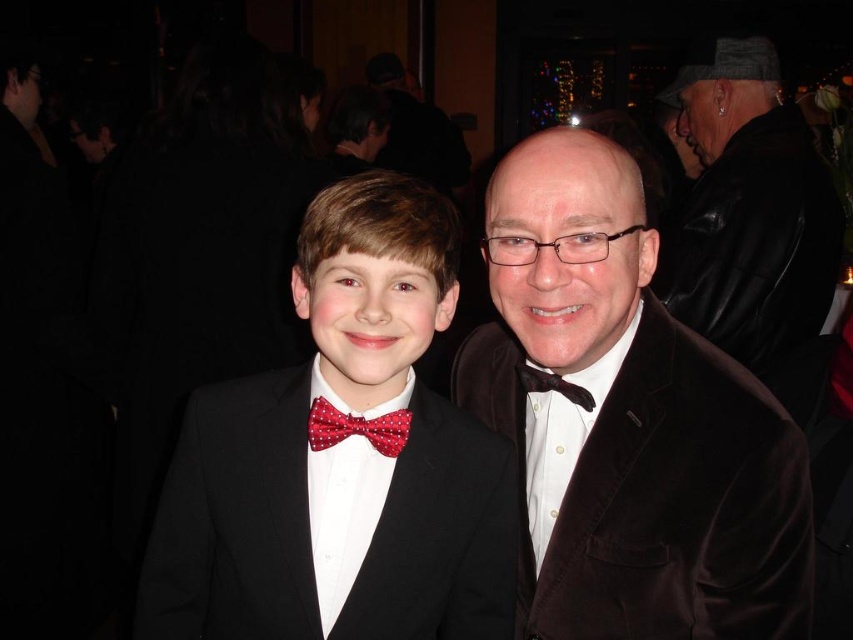
Who is lower down, velvet brown suit at right or dark red satin bow tie at center?

velvet brown suit at right is below.

Consider the image. Does velvet brown suit at right have a smaller size compared to dark red satin bow tie at center?

No, velvet brown suit at right is not smaller than dark red satin bow tie at center.

Does point (711, 392) lie behind point (582, 401)?

No.

Locate an element on the screen. velvet brown suit at right is located at coordinates (627, 422).

Does velvet brown suit at right have a smaller size compared to matte black suit at center?

No.

Between point (523, 164) and point (172, 468), which one is positioned behind?

The point (172, 468) is behind.

I want to click on velvet brown suit at right, so click(x=627, y=422).

Does matte black suit at center appear over red dotted bow tie at center?

Incorrect, matte black suit at center is not positioned above red dotted bow tie at center.

Is matte black suit at center further to the viewer compared to red dotted bow tie at center?

No, matte black suit at center is closer to the viewer.

Locate an element on the screen. matte black suit at center is located at coordinates (341, 460).